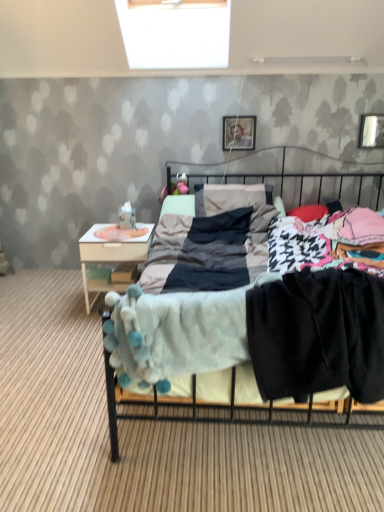
At what (x,y) coordinates should I click in order to perform the action: click on free location to the left of white wood nightstand at left. Please return your answer as a coordinate pair (x, y). The image size is (384, 512). Looking at the image, I should click on (62, 305).